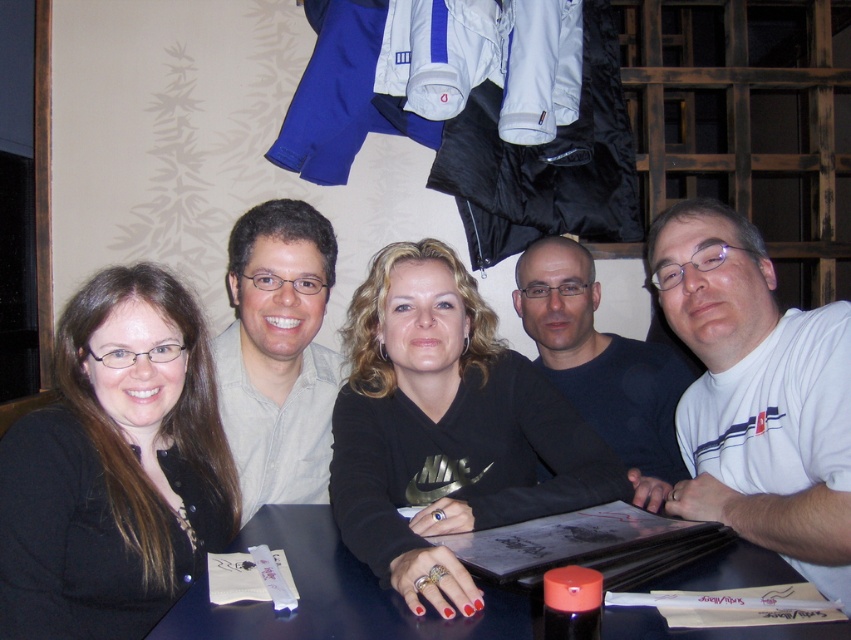
Does black matte/black shirt at left appear on the left side of black matte shirt at center?

Correct, you'll find black matte/black shirt at left to the left of black matte shirt at center.

Between point (78, 515) and point (530, 253), which one is positioned behind?

Point (530, 253)

At what (x,y) coordinates should I click in order to perform the action: click on black matte/black shirt at left. Please return your answer as a coordinate pair (x, y). The height and width of the screenshot is (640, 851). Looking at the image, I should click on (110, 483).

At what (x,y) coordinates should I click in order to perform the action: click on black matte/black shirt at left. Please return your answer as a coordinate pair (x, y). Looking at the image, I should click on (110, 483).

Between smooth dark wood table at center and black matte shirt at center, which one has less height?

smooth dark wood table at center is shorter.

Can you confirm if smooth dark wood table at center is positioned below black matte shirt at center?

Correct, smooth dark wood table at center is located below black matte shirt at center.

Is point (707, 636) in front of point (652, 403)?

Yes.

Locate an element on the screen. This screenshot has width=851, height=640. smooth dark wood table at center is located at coordinates (x=335, y=595).

Can you confirm if black matte/black sweater at center is bigger than white t-shirt at right?

Yes.

Between point (370, 566) and point (814, 468), which one is positioned in front?

Point (370, 566) is in front.

Locate an element on the screen. Image resolution: width=851 pixels, height=640 pixels. black matte/black sweater at center is located at coordinates (446, 428).